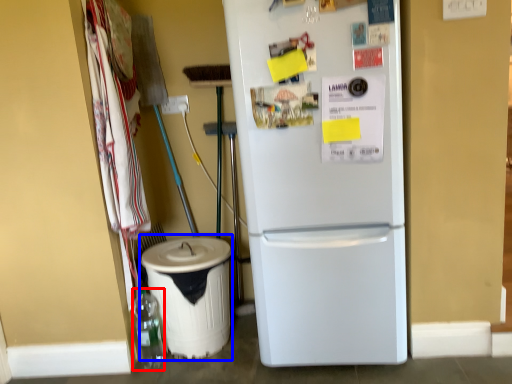
Question: Which point is further to the camera, bottle (highlighted by a red box) or recycling bin (highlighted by a blue box)?

Choices:
 (A) bottle
 (B) recycling bin

Answer: (A)